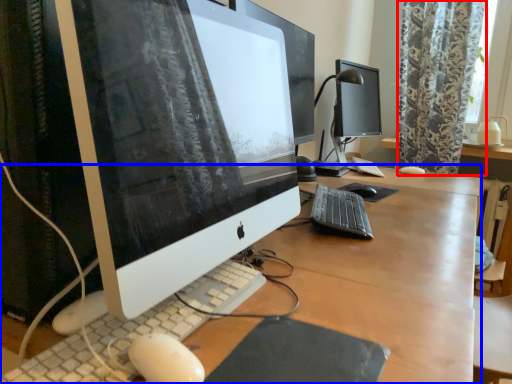
Question: Which of the following is the closest to the observer, curtain (highlighted by a red box) or desk (highlighted by a blue box)?

Choices:
 (A) curtain
 (B) desk

Answer: (B)